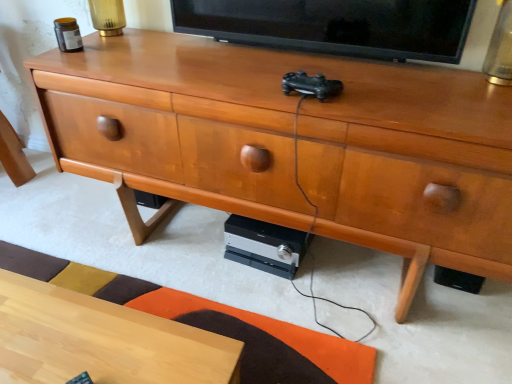
Locate an element on the screen. The height and width of the screenshot is (384, 512). vacant region to the right of silver/black plastic stereo at lower center is located at coordinates point(351,269).